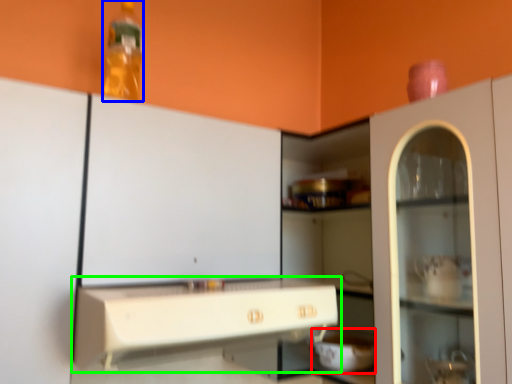
Question: Based on their relative distances, which object is nearer to appliance (highlighted by a red box)? Choose from bottle (highlighted by a blue box) and countertop (highlighted by a green box).

Choices:
 (A) bottle
 (B) countertop

Answer: (B)